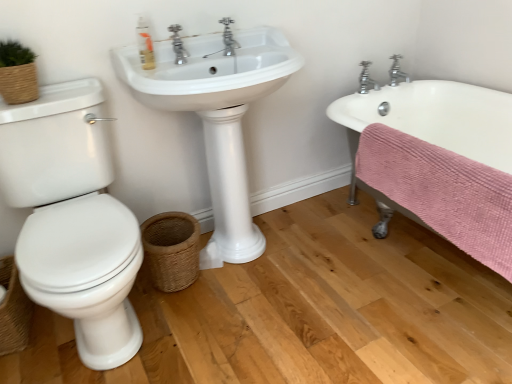
Question: Would you say pink textured towel at lower right is part of white glossy sink at center's contents?

Choices:
 (A) yes
 (B) no

Answer: (B)

Question: From the image's perspective, is white glossy sink at center located beneath pink textured towel at lower right?

Choices:
 (A) no
 (B) yes

Answer: (A)

Question: Does white glossy sink at center appear on the right side of pink textured towel at lower right?

Choices:
 (A) no
 (B) yes

Answer: (A)

Question: Can you confirm if white glossy sink at center is thinner than pink textured towel at lower right?

Choices:
 (A) yes
 (B) no

Answer: (B)

Question: Is white glossy sink at center further to camera compared to pink textured towel at lower right?

Choices:
 (A) yes
 (B) no

Answer: (A)

Question: Is pink textured towel at lower right inside the boundaries of chrome metallic faucet at upper center, the 3th tap when ordered from right to left, or outside?

Choices:
 (A) inside
 (B) outside

Answer: (B)

Question: In the image, is pink textured towel at lower right on the left side or the right side of chrome metallic faucet at upper center, which is the first tap in front-to-back order?

Choices:
 (A) right
 (B) left

Answer: (A)

Question: From the image's perspective, is pink textured towel at lower right located above or below chrome metallic faucet at upper center, the 3th tap when ordered from right to left?

Choices:
 (A) above
 (B) below

Answer: (B)

Question: Considering the positions of point (498, 152) and point (228, 51), is point (498, 152) closer or farther from the camera than point (228, 51)?

Choices:
 (A) closer
 (B) farther

Answer: (B)

Question: From the image's perspective, relative to white glossy sink at center, is woven brown basket at lower left, marked as the second basket in a right-to-left arrangement, above or below?

Choices:
 (A) below
 (B) above

Answer: (A)

Question: From their relative heights in the image, would you say woven brown basket at lower left, which is the 1th basket in left-to-right order, is taller or shorter than white glossy sink at center?

Choices:
 (A) tall
 (B) short

Answer: (B)

Question: Considering the relative positions of woven brown basket at lower left, marked as the second basket in a right-to-left arrangement, and white glossy sink at center in the image provided, is woven brown basket at lower left, marked as the second basket in a right-to-left arrangement, to the left or to the right of white glossy sink at center?

Choices:
 (A) right
 (B) left

Answer: (B)

Question: Relative to white glossy sink at center, is woven brown basket at lower left, which is the 1th basket in left-to-right order, in front or behind?

Choices:
 (A) behind
 (B) front

Answer: (A)

Question: Is woven brown basket at lower center, arranged as the 2th basket when viewed from the left, taller or shorter than chrome metallic faucet at upper right, the 1th tap positioned from the back?

Choices:
 (A) tall
 (B) short

Answer: (A)

Question: Is point (159, 258) closer or farther from the camera than point (399, 76)?

Choices:
 (A) farther
 (B) closer

Answer: (B)